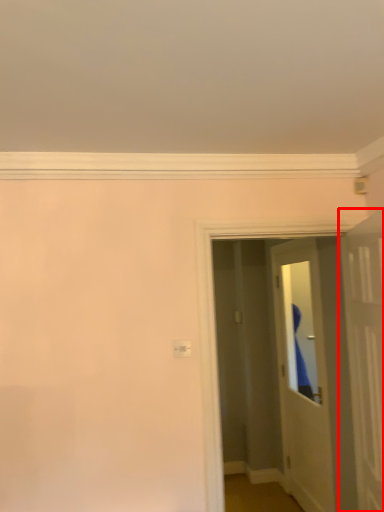
Question: From the image, what is the correct spatial relationship of door (annotated by the red box) in relation to door?

Choices:
 (A) left
 (B) right

Answer: (A)